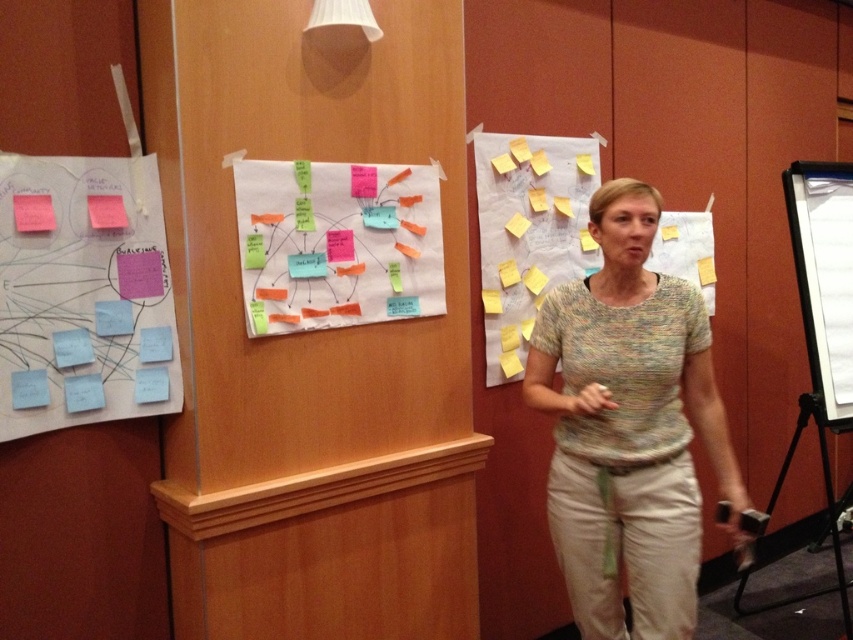
Does point (595, 282) come behind point (587, 141)?

No, (595, 282) is in front of (587, 141).

I want to click on multicolored knit sweater at center, so click(x=630, y=428).

From the picture: Is blue matte sticky notes at left smaller than yellow paper at upper right?

Yes, blue matte sticky notes at left is smaller than yellow paper at upper right.

Which of these two, blue matte sticky notes at left or yellow paper at upper right, stands taller?

yellow paper at upper right is taller.

Is point (170, 362) less distant than point (480, 161)?

That is True.

This screenshot has width=853, height=640. Find the location of `blue matte sticky notes at left`. blue matte sticky notes at left is located at coordinates (83, 292).

Between multicolored knit sweater at center and blue matte sticky notes at left, which one has more height?

multicolored knit sweater at center

Is multicolored knit sweater at center smaller than blue matte sticky notes at left?

Incorrect, multicolored knit sweater at center is not smaller in size than blue matte sticky notes at left.

Describe the element at coordinates (630, 428) in the screenshot. I see `multicolored knit sweater at center` at that location.

This screenshot has height=640, width=853. Find the location of `multicolored knit sweater at center`. multicolored knit sweater at center is located at coordinates (630, 428).